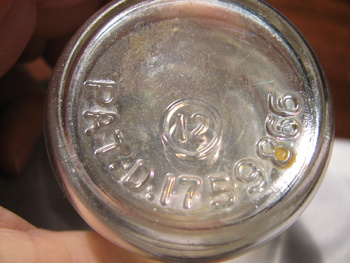
Locate an element on the screen. This screenshot has width=350, height=263. wooden block is located at coordinates (31, 97).